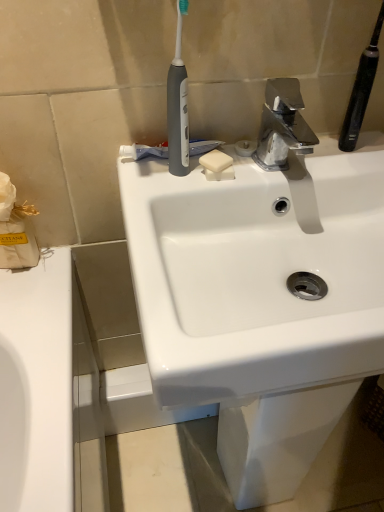
Where is `vacant area located to the right-hand side of gray matte toothbrush at upper center, which ranks as the second toothbrush in right-to-left order`? Image resolution: width=384 pixels, height=512 pixels. vacant area located to the right-hand side of gray matte toothbrush at upper center, which ranks as the second toothbrush in right-to-left order is located at coordinates (274, 167).